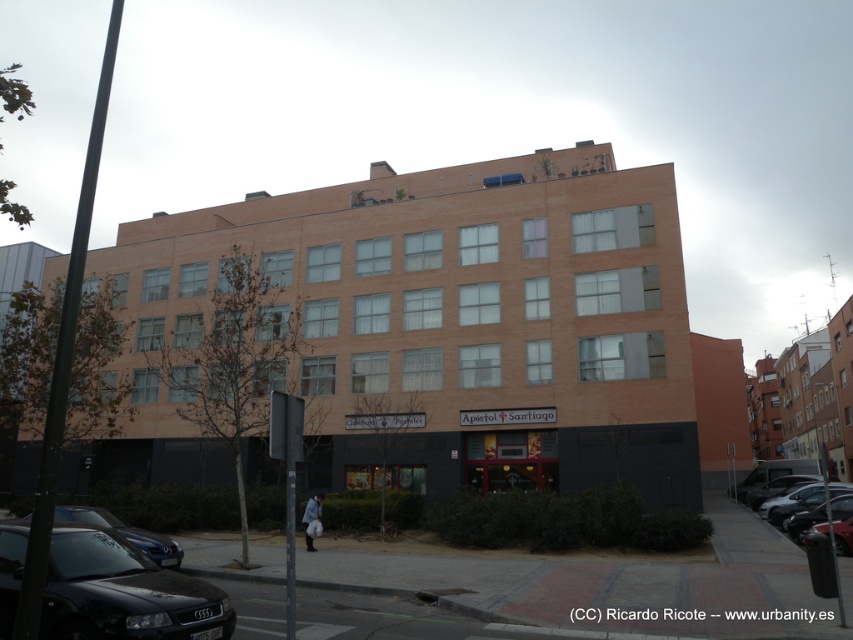
You are standing at the entrance of Apostol Santiago and want to park your car. The parking spot you want is located at point 0.758, 0.913. Is the shiny black car at right currently occupying that parking spot?

Yes, the shiny black car at right is occupying the parking spot at point (778,484) as per the 2D location provided.